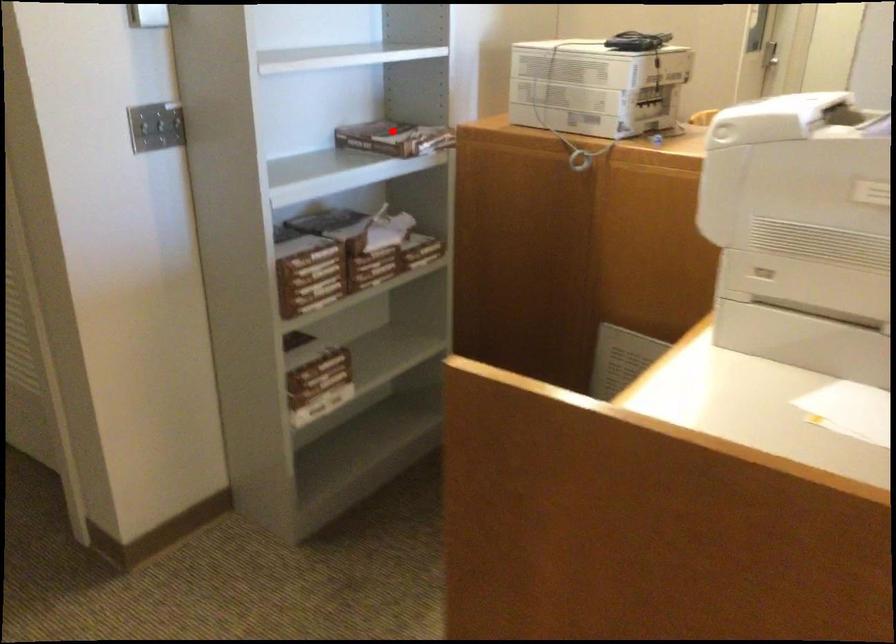
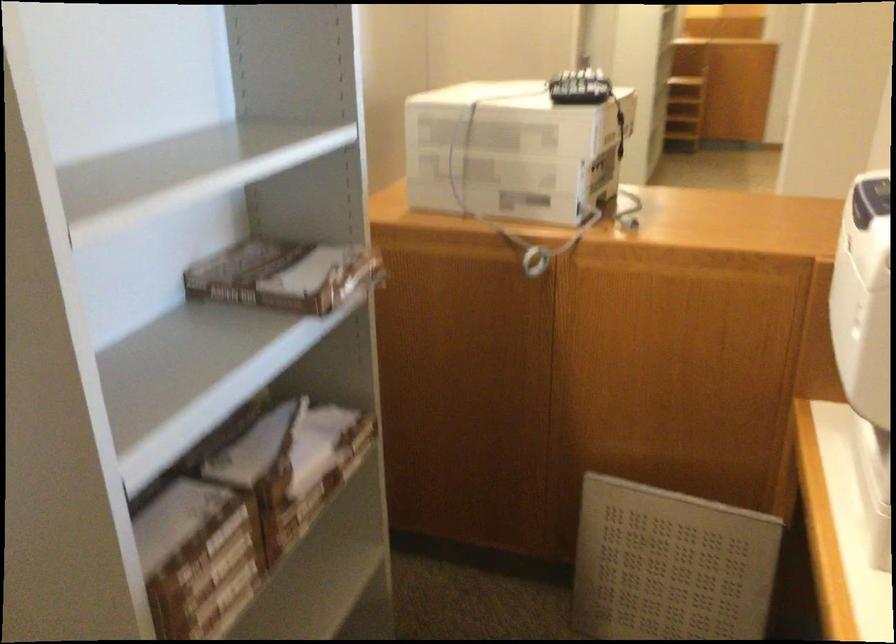
Question: A red point is marked in image1. In image2, is the corresponding 3D point closer to the camera or farther? Reply with the corresponding letter.

Choices:
 (A) The corresponding 3D point is closer.
 (B) The corresponding 3D point is farther.

Answer: (A)